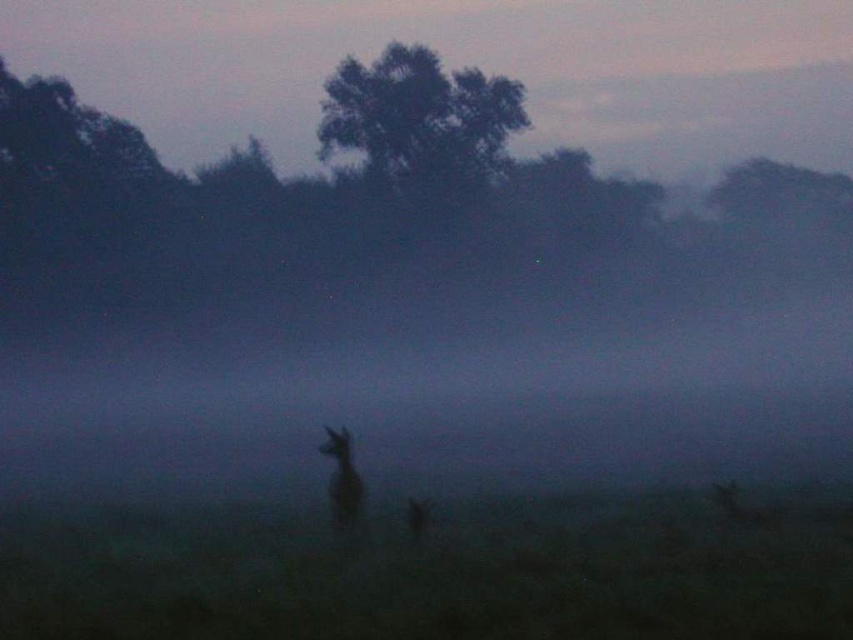
Does green leafy tree at upper center have a larger size compared to fuzzy brown deer at center?

Yes.

Locate an element on the screen. green leafy tree at upper center is located at coordinates (421, 122).